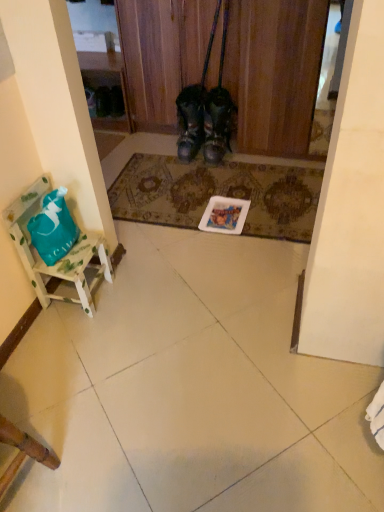
Question: Can you confirm if wooden chair at lower left is positioned to the left of leather boots at center, which is the second footwear from left to right?

Choices:
 (A) no
 (B) yes

Answer: (B)

Question: Would you say wooden chair at lower left is a long distance from leather boots at center, the first footwear in the right-to-left sequence?

Choices:
 (A) yes
 (B) no

Answer: (A)

Question: Is wooden chair at lower left positioned before leather boots at center, the first footwear in the right-to-left sequence?

Choices:
 (A) yes
 (B) no

Answer: (A)

Question: From the image's perspective, does wooden chair at lower left appear higher than leather boots at center, the first footwear in the right-to-left sequence?

Choices:
 (A) no
 (B) yes

Answer: (A)

Question: Can you confirm if wooden chair at lower left is wider than leather boots at center, which is the second footwear from left to right?

Choices:
 (A) yes
 (B) no

Answer: (B)

Question: Can you confirm if wooden chair at lower left is bigger than leather boots at center, the first footwear in the right-to-left sequence?

Choices:
 (A) no
 (B) yes

Answer: (B)

Question: Is black leather boots at center closer to camera compared to leather boots at center, which is the second footwear from left to right?

Choices:
 (A) yes
 (B) no

Answer: (A)

Question: From a real-world perspective, is black leather boots at center physically above leather boots at center, which is the second footwear from left to right?

Choices:
 (A) no
 (B) yes

Answer: (B)

Question: Considering the relative positions of black leather boots at center and leather boots at center, which is the second footwear from left to right, in the image provided, is black leather boots at center behind leather boots at center, which is the second footwear from left to right,?

Choices:
 (A) yes
 (B) no

Answer: (B)

Question: Is black leather boots at center looking in the opposite direction of leather boots at center, which is the second footwear from left to right?

Choices:
 (A) yes
 (B) no

Answer: (B)

Question: Could you tell me if black leather boots at center is turned towards leather boots at center, the first footwear in the right-to-left sequence?

Choices:
 (A) no
 (B) yes

Answer: (B)

Question: Can you confirm if black leather boots at center is thinner than leather boots at center, the first footwear in the right-to-left sequence?

Choices:
 (A) yes
 (B) no

Answer: (B)

Question: Is the depth of black leather boots at center greater than that of white wood chair at left?

Choices:
 (A) yes
 (B) no

Answer: (A)